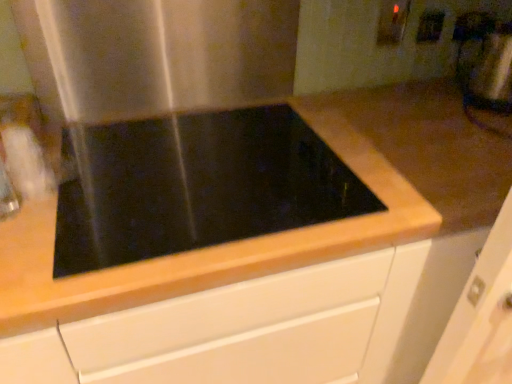
At what (x,y) coordinates should I click in order to perform the action: click on free space in front of stainless steel at upper left. Please return your answer as a coordinate pair (x, y). This screenshot has height=384, width=512. Looking at the image, I should click on (172, 179).